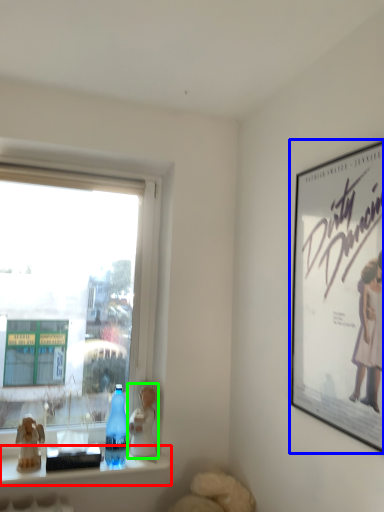
Question: Which is farther away from window sill (highlighted by a red box)? picture frame (highlighted by a blue box) or figurine (highlighted by a green box)?

Choices:
 (A) picture frame
 (B) figurine

Answer: (A)